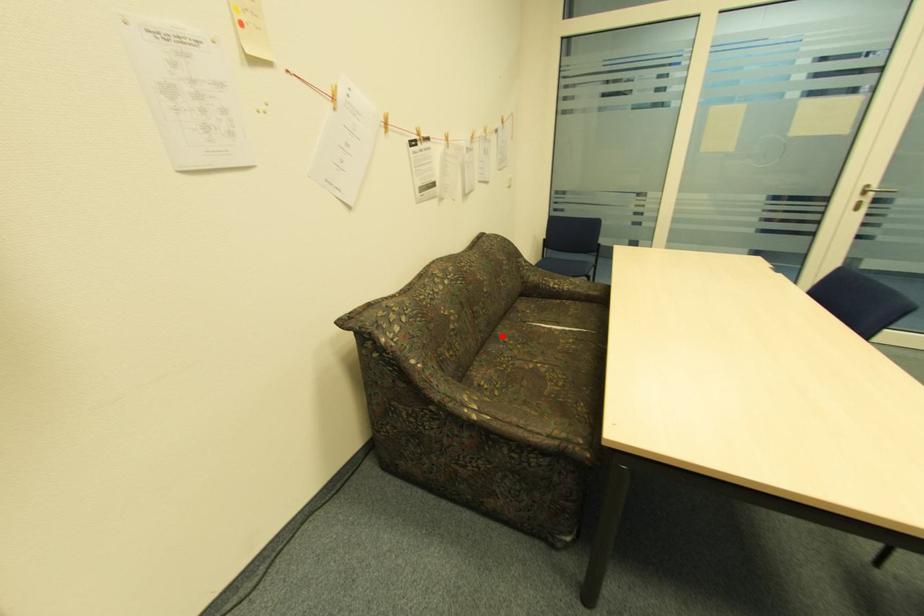
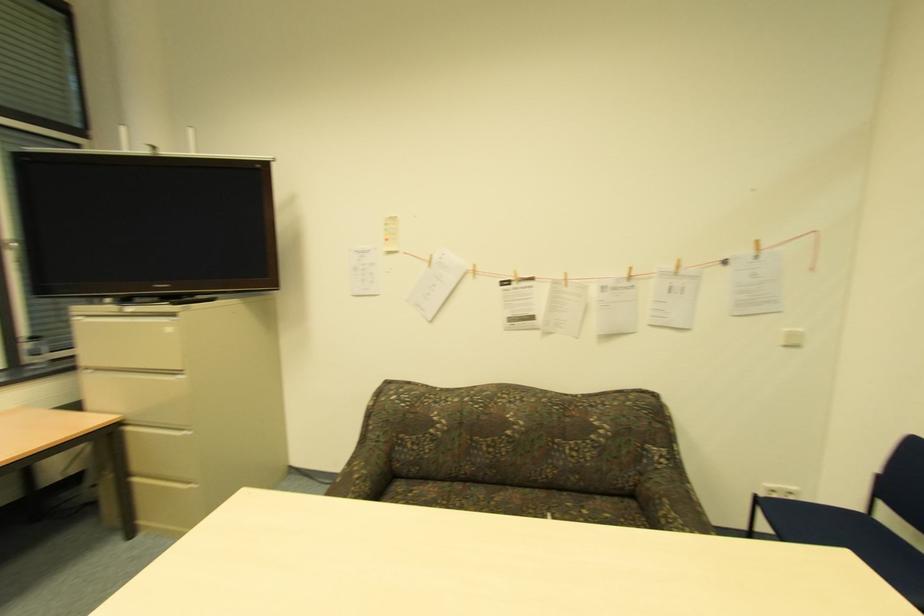
Question: I am providing you with two images of the same scene from different viewpoints. In image1, a red point is highlighted. Considering the same 3D point in image2, which of the following is correct?

Choices:
 (A) It is closer
 (B) It is farther

Answer: (B)